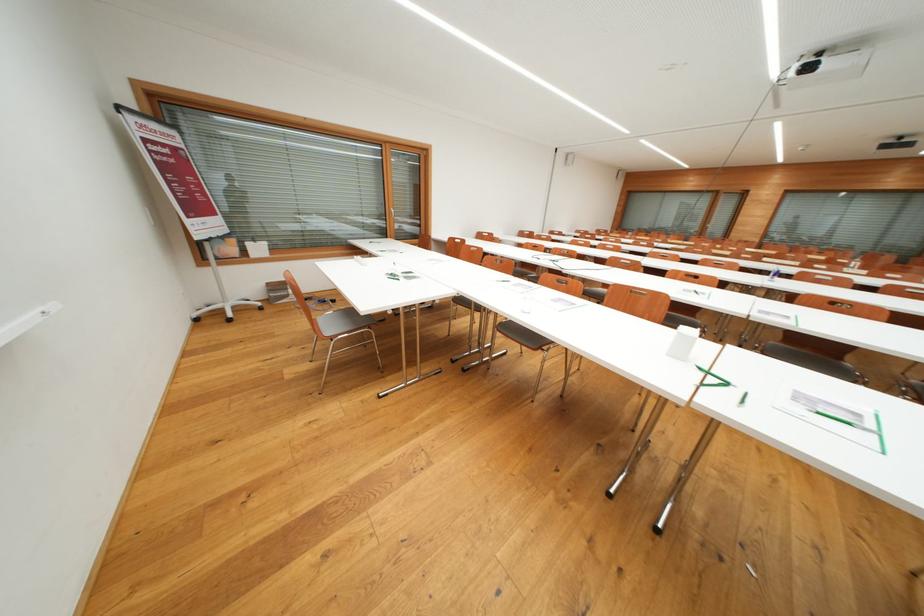
The location [683,342] corresponds to which object?

It refers to a small white box.